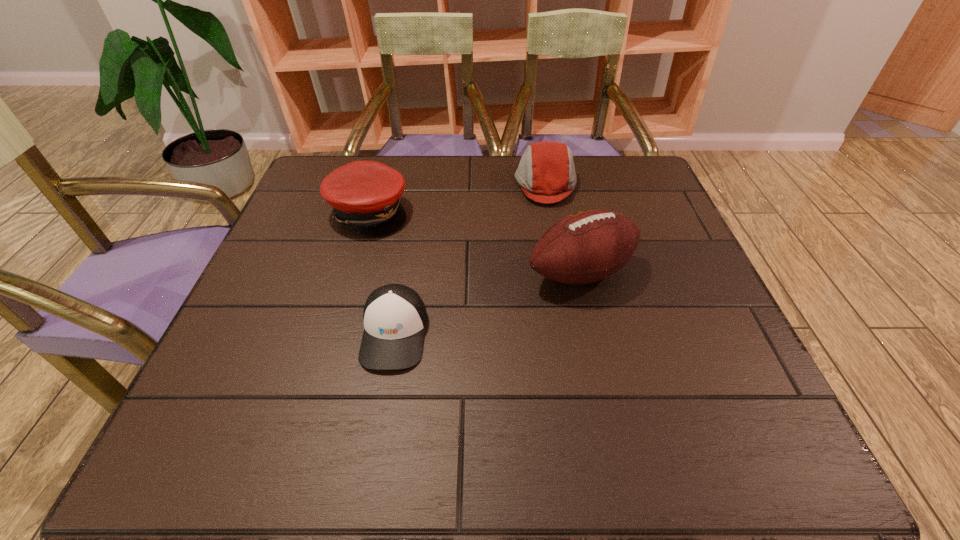
I want to click on the tallest object, so click(584, 247).

The width and height of the screenshot is (960, 540). I want to click on the rightmost cap, so click(x=546, y=173).

Locate an element on the screen. The image size is (960, 540). the nearest cap is located at coordinates tap(395, 317).

The image size is (960, 540). In order to click on vacant space situated 0.060m on the back of the tallest object in this screenshot , I will do `click(571, 231)`.

You are a GUI agent. You are given a task and a screenshot of the screen. Output one action in this format:
    pyautogui.click(x=<x>, y=<y>)
    Task: Click on the vacant region located 0.210m on the front-facing side of the rightmost cap
    
    Given the screenshot: What is the action you would take?
    pyautogui.click(x=438, y=184)

At what (x,y) coordinates should I click in order to perform the action: click on blank space located on the front-facing side of the rightmost cap. Please return your answer as a coordinate pair (x, y). This screenshot has width=960, height=540. Looking at the image, I should click on (478, 184).

At what (x,y) coordinates should I click in order to perform the action: click on free location located on the front-facing side of the rightmost cap. Please return your answer as a coordinate pair (x, y). The width and height of the screenshot is (960, 540). Looking at the image, I should click on (453, 184).

In order to click on free space located on the front panel of the nearest cap in this screenshot , I will do `click(378, 427)`.

At what (x,y) coordinates should I click in order to perform the action: click on object located at the left edge. Please return your answer as a coordinate pair (x, y). Looking at the image, I should click on (365, 195).

At what (x,y) coordinates should I click in order to perform the action: click on object present at the right edge. Please return your answer as a coordinate pair (x, y). This screenshot has height=540, width=960. Looking at the image, I should click on (584, 247).